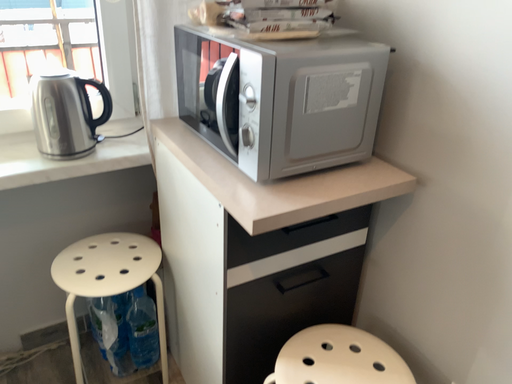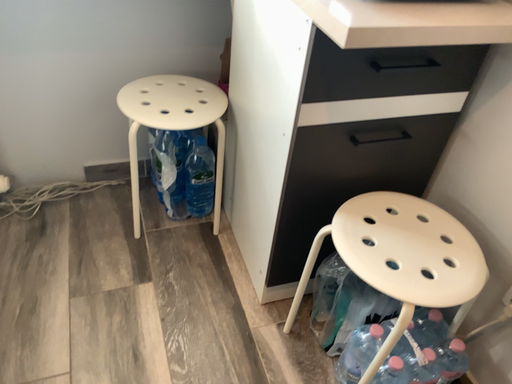
Question: How did the camera likely rotate when shooting the video?

Choices:
 (A) rotated left
 (B) rotated right

Answer: (A)